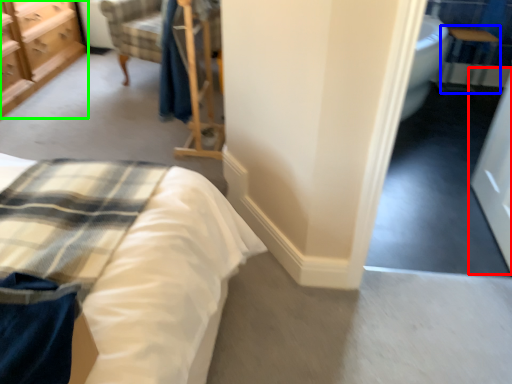
Question: Estimate the real-world distances between objects in this image. Which object is farther from screen door (highlighted by a red box), table (highlighted by a blue box) or chest of drawers (highlighted by a green box)?

Choices:
 (A) table
 (B) chest of drawers

Answer: (B)